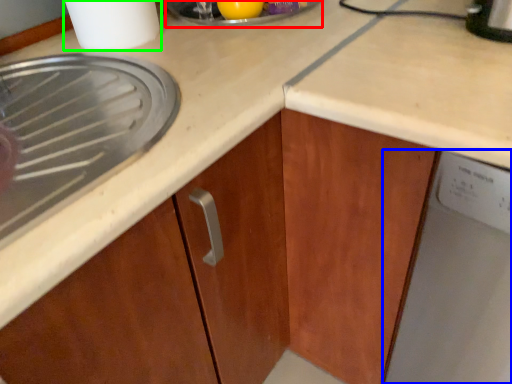
Question: Which is nearer to the appliance (highlighted by a red box)? home appliance (highlighted by a blue box) or kitchen appliance (highlighted by a green box).

Choices:
 (A) home appliance
 (B) kitchen appliance

Answer: (B)